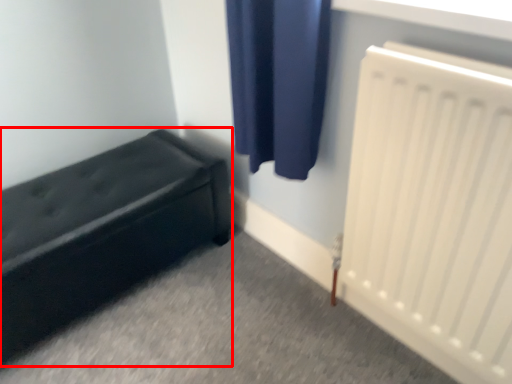
Question: From the image's perspective, considering the relative positions of furniture (annotated by the red box) and radiator in the image provided, where is furniture (annotated by the red box) located with respect to the staircase?

Choices:
 (A) below
 (B) above

Answer: (A)